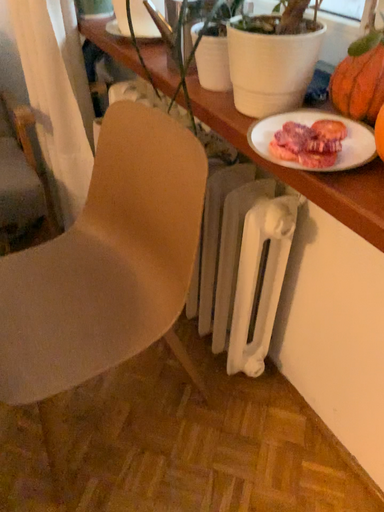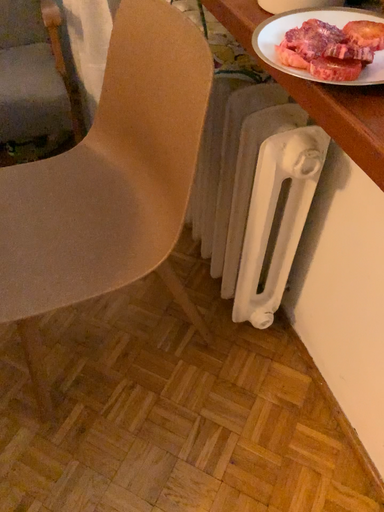
Question: How did the camera likely rotate when shooting the video?

Choices:
 (A) rotated upward
 (B) rotated downward

Answer: (B)